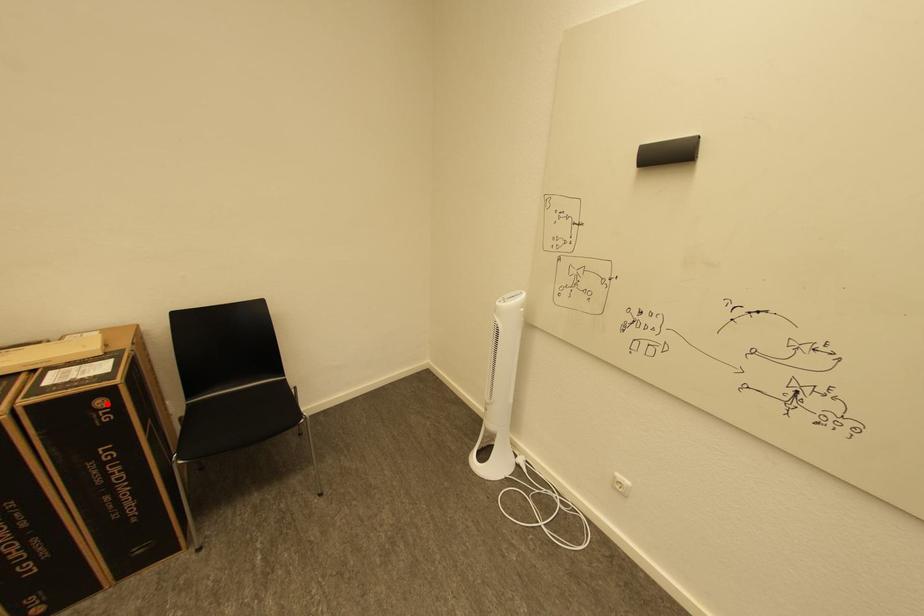
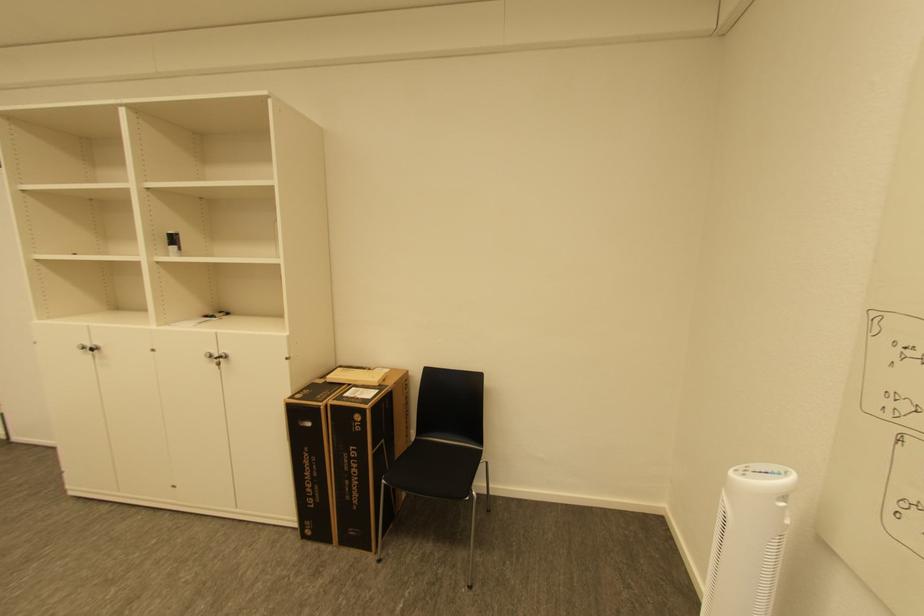
Question: A red point is marked in image1. In image2, is the corresponding 3D point closer to the camera or farther? Reply with the corresponding letter.

Choices:
 (A) The corresponding 3D point is closer.
 (B) The corresponding 3D point is farther.

Answer: (B)